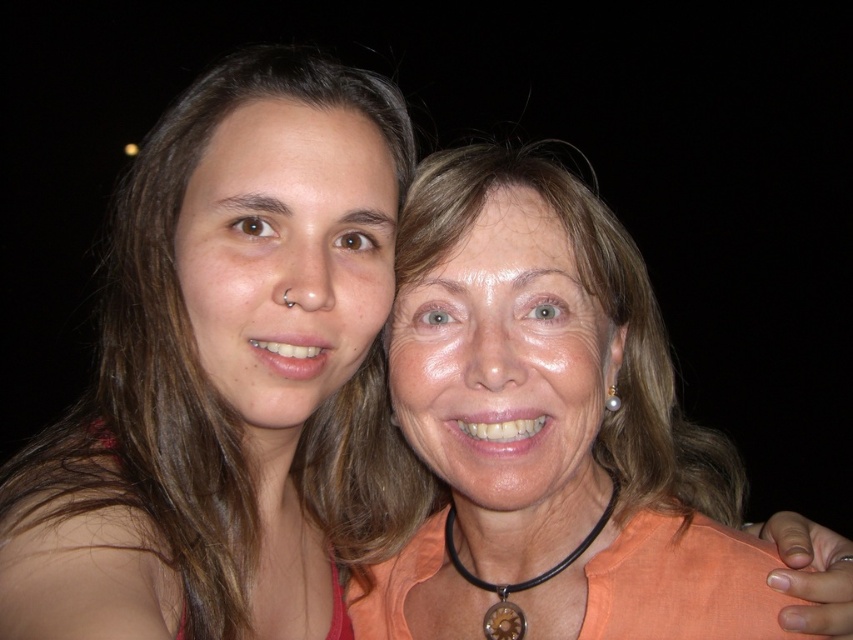
In the scene shown: Does matte orange blouse at center have a lesser width compared to black leather necklace at center?

No.

Does point (444, 157) come closer to viewer compared to point (515, 588)?

Yes, point (444, 157) is in front of point (515, 588).

Locate an element on the screen. This screenshot has width=853, height=640. matte orange blouse at center is located at coordinates (599, 401).